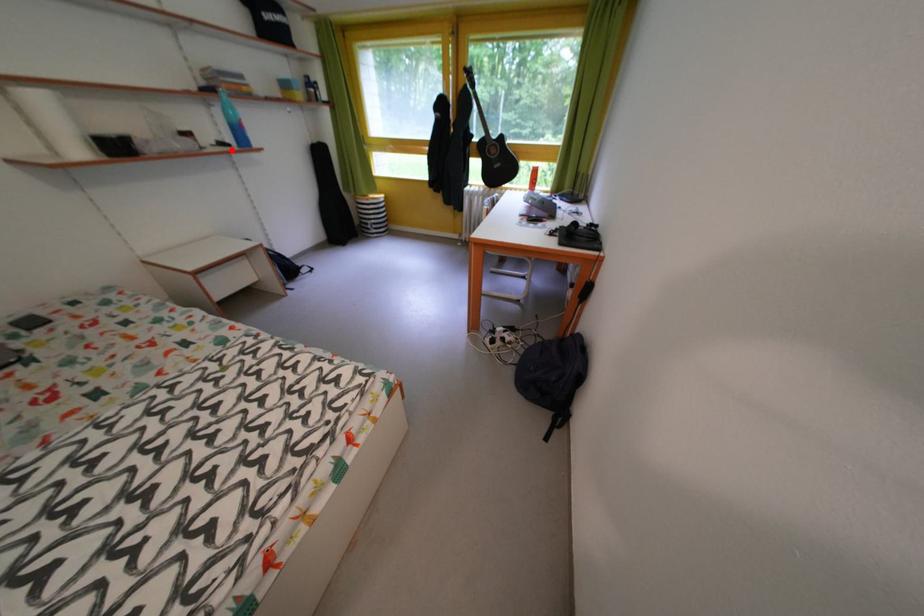
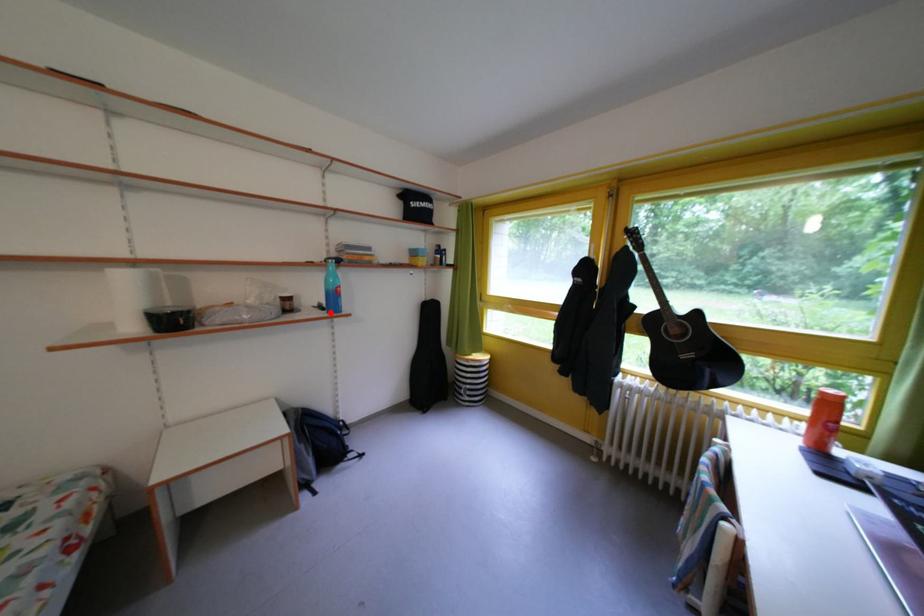
I am providing you with two images of the same scene from different viewpoints. A red point is marked on the first image and another point is marked on the second image. Are the points marked in image1 and image2 representing the same 3D position?

Yes